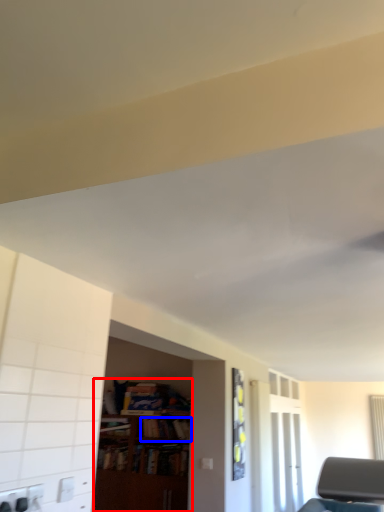
Question: Which object is further to the camera taking this photo, bookcase (highlighted by a red box) or book (highlighted by a blue box)?

Choices:
 (A) bookcase
 (B) book

Answer: (B)